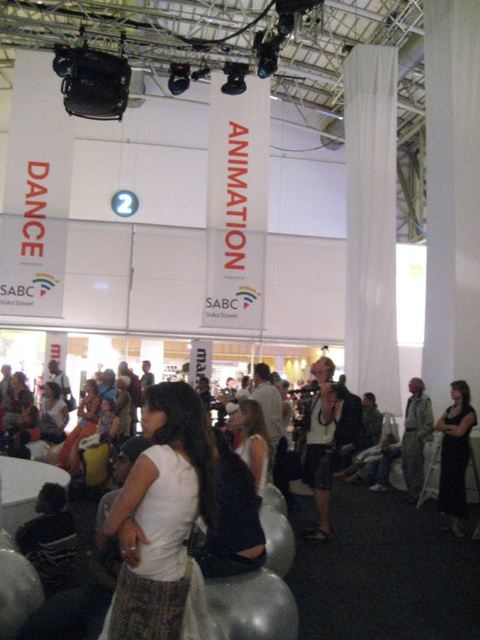
Does white matte dress at center have a lesser height compared to matte white dress at center?

Yes.

Does white matte dress at center have a greater height compared to matte white dress at center?

Incorrect, white matte dress at center's height is not larger of matte white dress at center's.

You are a GUI agent. You are given a task and a screenshot of the screen. Output one action in this format:
    pyautogui.click(x=<x>, y=<y>)
    Task: Click on the white matte dress at center
    Image resolution: width=480 pixels, height=640 pixels.
    Given the screenshot: What is the action you would take?
    pyautogui.click(x=252, y=440)

In the scene shown: Is black satin dress at right positioned at the back of white matte dress at center?

Yes, black satin dress at right is further from the viewer.

Identify the location of black satin dress at right. Image resolution: width=480 pixels, height=640 pixels. (455, 454).

Which is more to the left, white fabric dress at center or white matte dress at center?

white fabric dress at center is more to the left.

Does white fabric dress at center have a greater width compared to white matte dress at center?

Indeed, white fabric dress at center has a greater width compared to white matte dress at center.

Is point (176, 616) closer to viewer compared to point (263, 419)?

Yes, it is in front of point (263, 419).

At what (x,y) coordinates should I click in order to perform the action: click on white fabric dress at center. Please return your answer as a coordinate pair (x, y). Looking at the image, I should click on (164, 518).